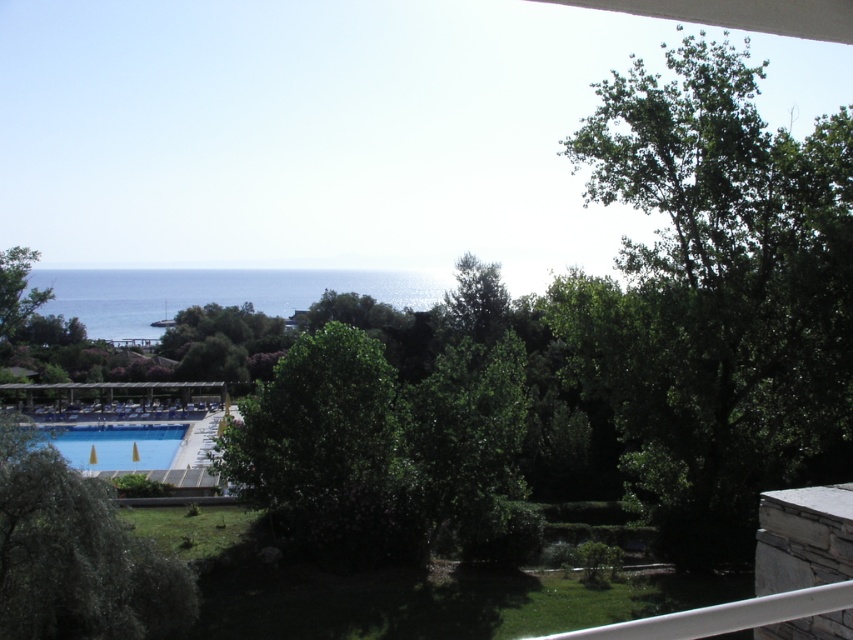
You are standing on the balcony and want to take a photo that includes both the green leafy tree at upper right and the green leafy tree at center. Which tree should you frame closer to the edge of the photo to ensure both are visible?

You should frame the green leafy tree at center closer to the edge of the photo because the green leafy tree at upper right is larger in size and might block the smaller tree if centered.

You are standing on the balcony and want to take a photo of both the green leafy tree at upper right and the blue glossy pool at lower left. Which object should you frame first in your camera to ensure both are in the shot?

You should frame the green leafy tree at upper right first because it is positioned on the right side of the blue glossy pool at lower left, so starting with the tree ensures the pool will be included in the shot.

You are planning to take a photo of both the green leafy tree at upper right and the blue glossy pool at lower left. Which object should you frame first in your camera to ensure both are fully visible in the photo?

You should frame the green leafy tree at upper right first because it has a larger width than the blue glossy pool at lower left, so it requires more space in the frame.